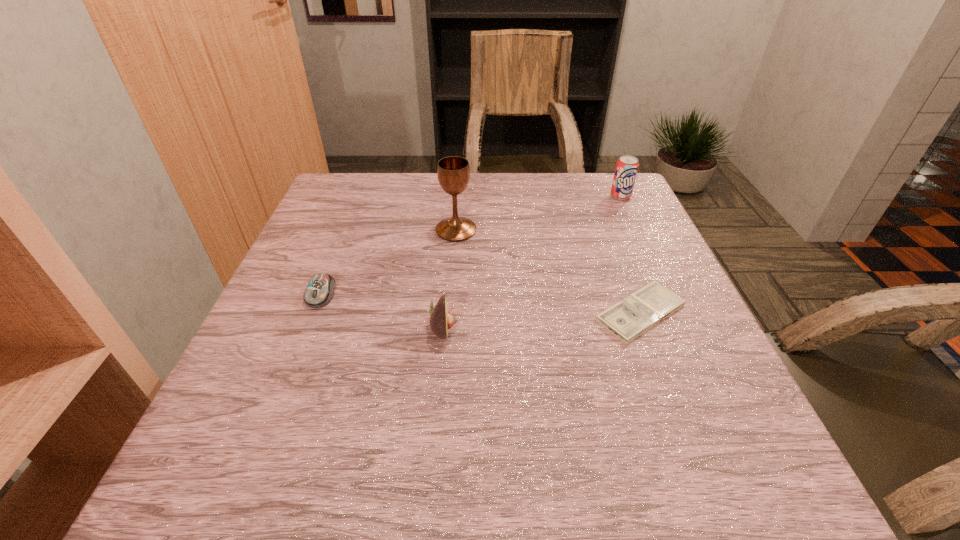
You are a GUI agent. You are given a task and a screenshot of the screen. Output one action in this format:
    pyautogui.click(x=<x>, y=<y>)
    Task: Click on the second farthest object
    
    Given the screenshot: What is the action you would take?
    pyautogui.click(x=453, y=172)

This screenshot has width=960, height=540. Find the location of `the tallest object`. the tallest object is located at coordinates (453, 172).

This screenshot has height=540, width=960. I want to click on soda can, so click(627, 166).

This screenshot has height=540, width=960. I want to click on avocado, so click(441, 320).

Locate an element on the screen. This screenshot has width=960, height=540. the second shortest object is located at coordinates (x=319, y=292).

What are the coordinates of `the leftmost object` in the screenshot? It's located at (319, 292).

Locate an element on the screen. This screenshot has height=540, width=960. dollar is located at coordinates (634, 315).

The width and height of the screenshot is (960, 540). I want to click on vacant region located 0.340m on the right of the tallest object, so click(x=615, y=230).

Identify the location of vacant region located 0.310m on the front of the farthest object. This screenshot has height=540, width=960. (659, 278).

You are a GUI agent. You are given a task and a screenshot of the screen. Output one action in this format:
    pyautogui.click(x=<x>, y=<y>)
    Task: Click on the vacant space situated 0.350m on the seed side of the avocado
    This screenshot has height=540, width=960.
    Given the screenshot: What is the action you would take?
    pyautogui.click(x=642, y=328)